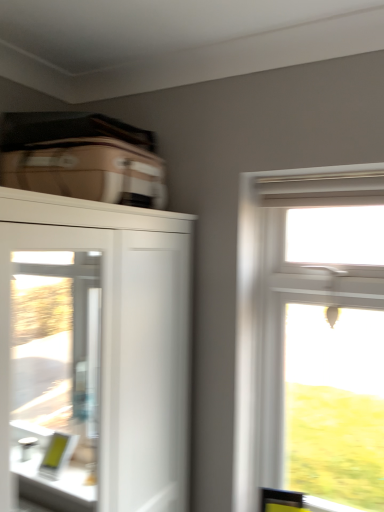
Question: Considering their positions, is clear glass screen door at left located in front of or behind white glossy cupboard at upper left?

Choices:
 (A) behind
 (B) front

Answer: (A)

Question: From the image's perspective, relative to white glossy cupboard at upper left, is clear glass screen door at left above or below?

Choices:
 (A) below
 (B) above

Answer: (B)

Question: Based on their relative distances, which object is nearer to the beige fabric suitcase at upper left?

Choices:
 (A) clear glass screen door at left
 (B) clear glass window at upper right
 (C) white glossy cupboard at upper left

Answer: (B)

Question: Which is farther from the white glossy cupboard at upper left?

Choices:
 (A) beige fabric suitcase at upper left
 (B) clear glass screen door at left
 (C) clear glass window at upper right

Answer: (C)